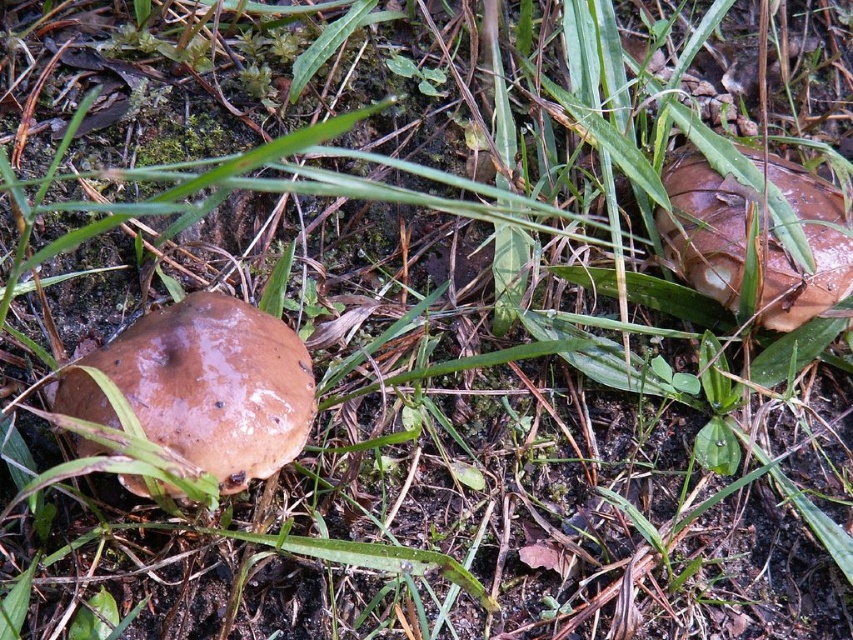
Based on the photo, between brown matte mushroom at lower left and brown matte mushroom at right, which one is positioned lower?

brown matte mushroom at lower left is below.

Between point (196, 429) and point (689, 212), which one is positioned in front?

Point (196, 429) is in front.

Is point (277, 435) positioned after point (665, 211)?

No, (277, 435) is in front of (665, 211).

Where is `brown matte mushroom at lower left`? brown matte mushroom at lower left is located at coordinates (x=215, y=385).